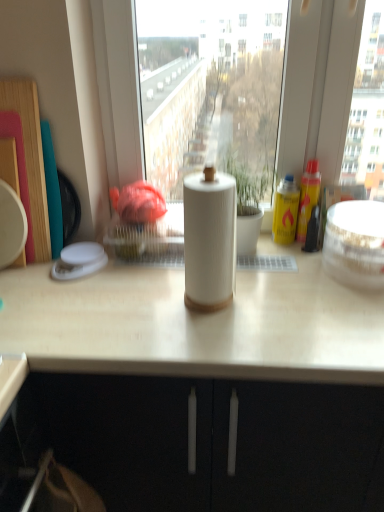
Find the location of a particular element. vacant space to the left of white glossy bowl at right, which is the 2th appliance from left to right is located at coordinates (275, 278).